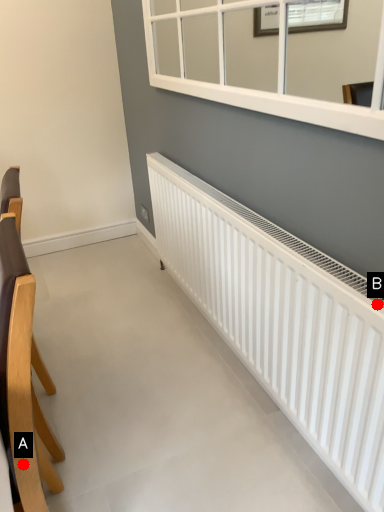
Question: Two points are circled on the image, labeled by A and B beside each circle. Which point is further to the camera?

Choices:
 (A) A is further
 (B) B is further

Answer: (B)